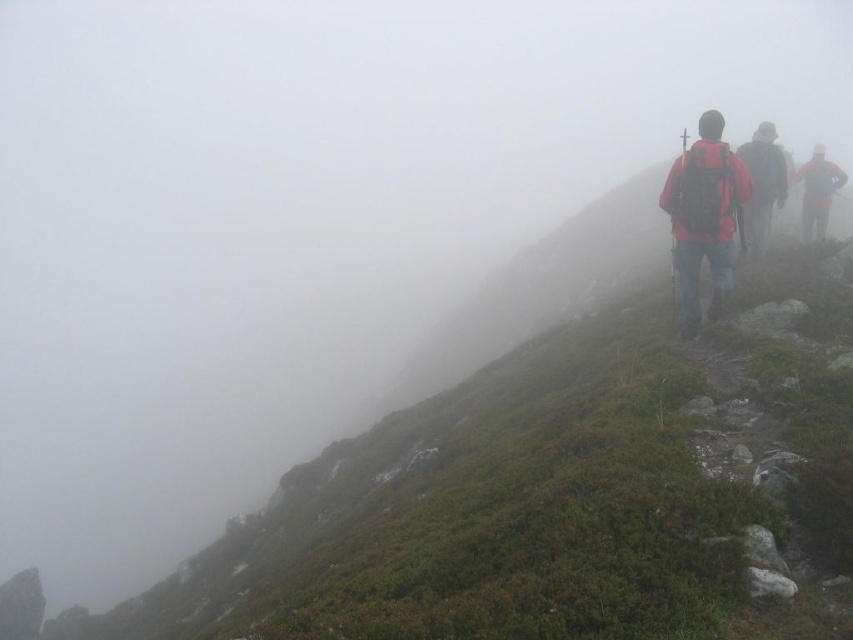
The image size is (853, 640). Find the location of `matte pink backpack at right`. matte pink backpack at right is located at coordinates (704, 214).

Measure the distance between matte pink backpack at right and red backpack at center.

matte pink backpack at right is 34.46 meters from red backpack at center.

This screenshot has height=640, width=853. Describe the element at coordinates (704, 214) in the screenshot. I see `matte pink backpack at right` at that location.

What are the coordinates of `matte pink backpack at right` in the screenshot? It's located at (704, 214).

Is point (724, 236) closer to camera compared to point (809, 230)?

Yes, point (724, 236) is in front of point (809, 230).

Which is behind, point (728, 177) or point (805, 161)?

The point (805, 161) is behind.

What do you see at coordinates (704, 214) in the screenshot? I see `matte pink backpack at right` at bounding box center [704, 214].

This screenshot has height=640, width=853. Find the location of `matte pink backpack at right`. matte pink backpack at right is located at coordinates (704, 214).

Who is more forward, (x=753, y=246) or (x=811, y=148)?

Point (x=753, y=246) is more forward.

Which is above, red backpack at center or red matte jacket at upper right?

red backpack at center is higher up.

This screenshot has width=853, height=640. In order to click on red backpack at center in this screenshot , I will do `click(761, 186)`.